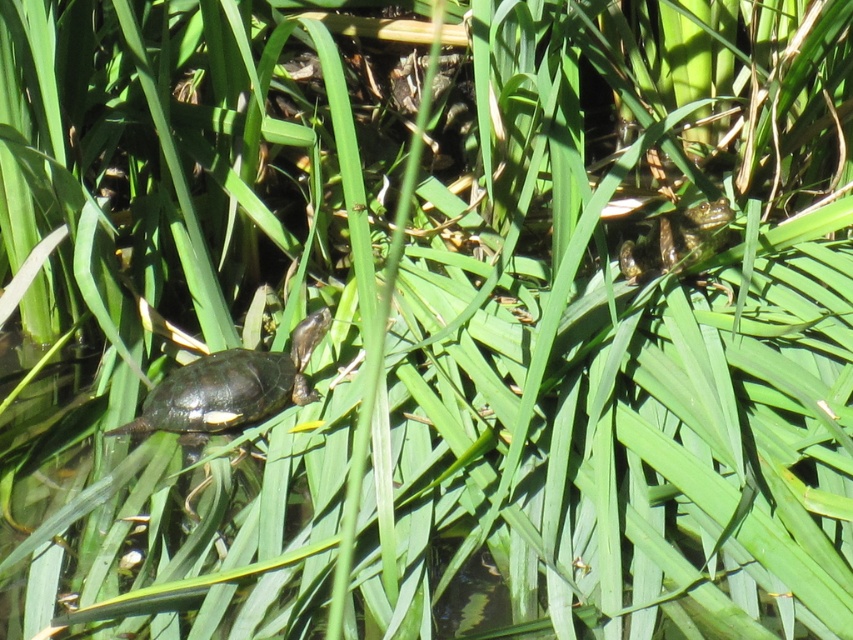
You are a hiker who wants to take a photo of both the shiny black tortoise at left and the green scaly tortoise at upper right. Which tortoise should you focus on first if you want to capture both in the same frame without moving your camera?

You should focus on the shiny black tortoise at left first because it is lower than the green scaly tortoise at upper right, so adjusting the camera angle to include both would require framing from the lower to the upper part of the scene.

You are a nature photographer trying to capture both the shiny black tortoise at left and the green scaly tortoise at upper right in a single frame. Given their sizes, which tortoise will appear bigger in your photo?

The shiny black tortoise at left will appear bigger in the photo because it is larger in size than the green scaly tortoise at upper right.

Based on the photo, you are standing in the scene and see a point marked at coordinates (230,387). Which animal is closest to that point?

The point at (230,387) is closest to the shiny black tortoise at left.